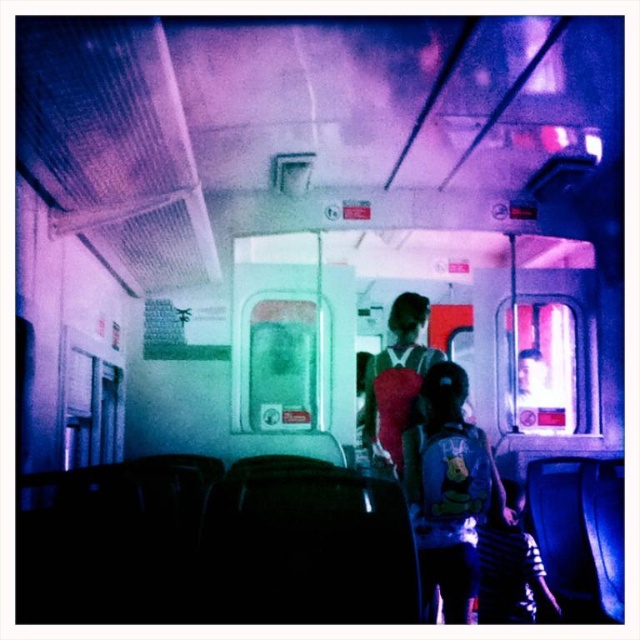
Does matte blue backpack at center have a greater height compared to matte pink backpack at center?

Yes.

What do you see at coordinates (449, 488) in the screenshot? I see `matte blue backpack at center` at bounding box center [449, 488].

Locate an element on the screen. matte blue backpack at center is located at coordinates (449, 488).